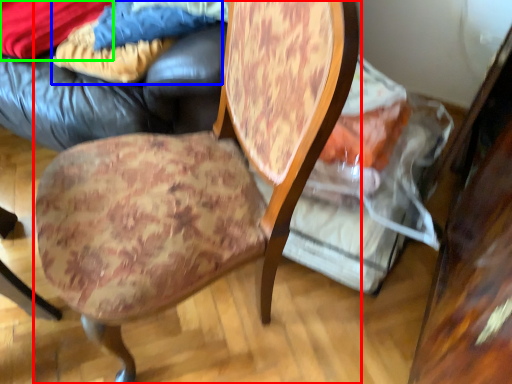
Question: Which is nearer to the chair (highlighted by a red box)? fabric (highlighted by a blue box) or fabric (highlighted by a green box).

Choices:
 (A) fabric
 (B) fabric

Answer: (A)